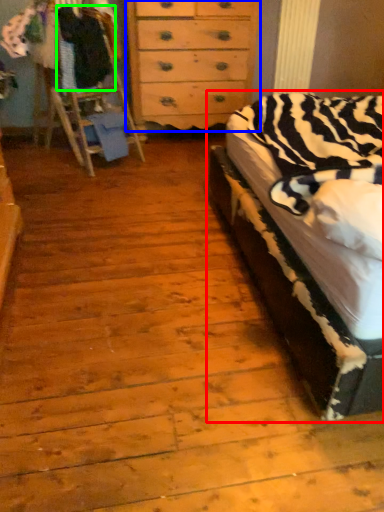
Question: Considering the real-world distances, which object is closest to bed (highlighted by a red box)? chest of drawers (highlighted by a blue box) or clothing (highlighted by a green box).

Choices:
 (A) chest of drawers
 (B) clothing

Answer: (A)